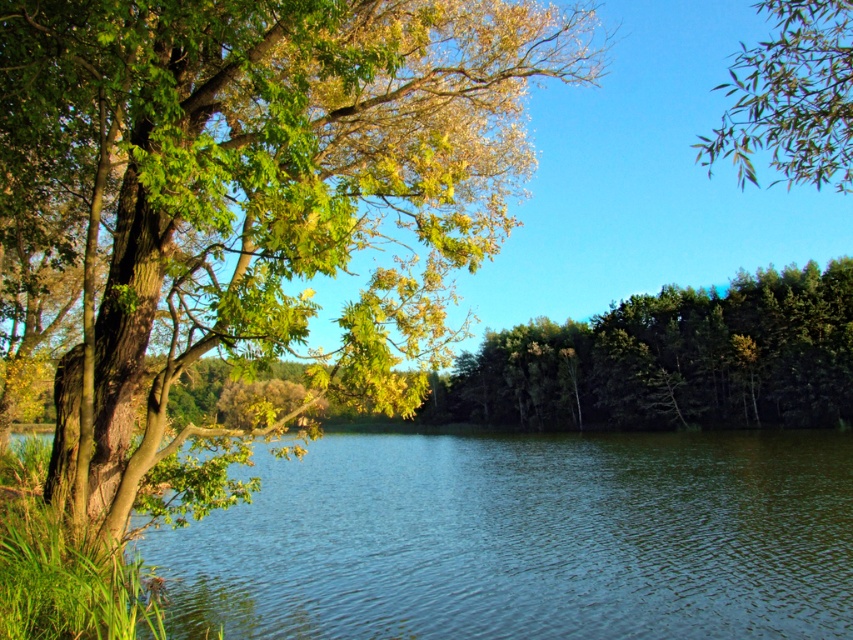
Consider the image. You are standing at the center of the image and want to locate the green leafy tree at left. According to the coordinates, in which direction should you look to find it?

The green leafy tree at left is located at coordinates point (252, 204), so you should look to the left side of the image to find it.

You are a photographer planning to capture the green leafy tree at left and the clear blue water at center in a single frame. Based on their sizes in the image, which object should you focus on first if you want both to be in sharp focus?

The green leafy tree at left occupies less space than the clear blue water at center, so you should focus on the clear blue water at center first since it takes up more of the frame and will require more precise focusing to ensure sharpness throughout.